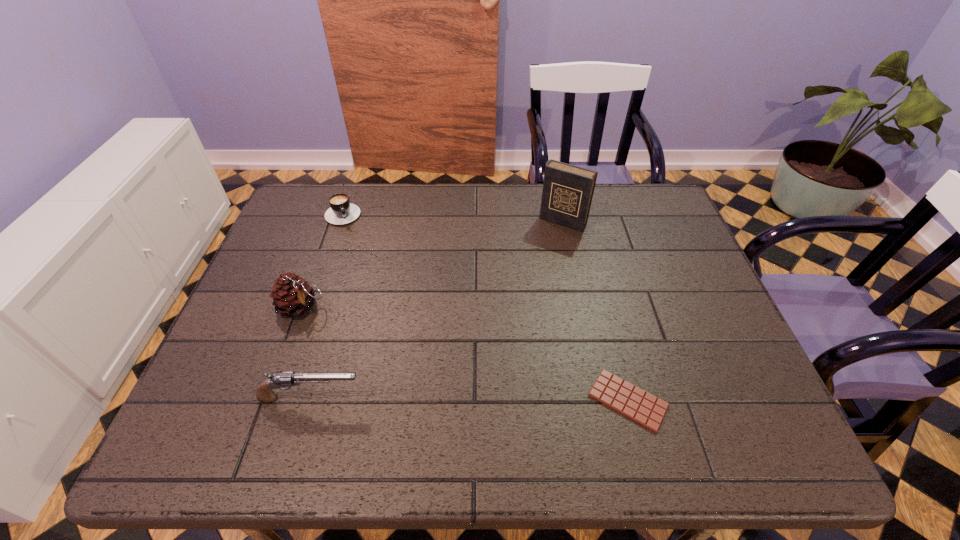
Find the location of a particular element. This screenshot has width=960, height=540. object that stands as the closest to the candy bar is located at coordinates (567, 194).

Identify which object is the second closest to the third nearest object. Please provide its 2D coordinates. Your answer should be formatted as a tuple, i.e. [(x, y)], where the tuple contains the x and y coordinates of a point satisfying the conditions above.

[(341, 211)]

Locate an element on the screen. This screenshot has width=960, height=540. free location that satisfies the following two spatial constraints: 1. on the front side of the pinecone; 2. aiming along the barrel of the gun is located at coordinates (268, 398).

What are the coordinates of `vacant space that satisfies the following two spatial constraints: 1. on the front side of the cappuccino; 2. on the left side of the diary` in the screenshot? It's located at (341, 221).

Image resolution: width=960 pixels, height=540 pixels. I want to click on vacant area that satisfies the following two spatial constraints: 1. on the front side of the candy bar; 2. on the right side of the diary, so click(600, 400).

Identify the location of vacant space that satisfies the following two spatial constraints: 1. on the front side of the cappuccino; 2. aiming along the barrel of the third shortest object. [279, 398].

I want to click on free location that satisfies the following two spatial constraints: 1. on the front side of the third shortest object; 2. aiming along the barrel of the pinecone, so click(268, 398).